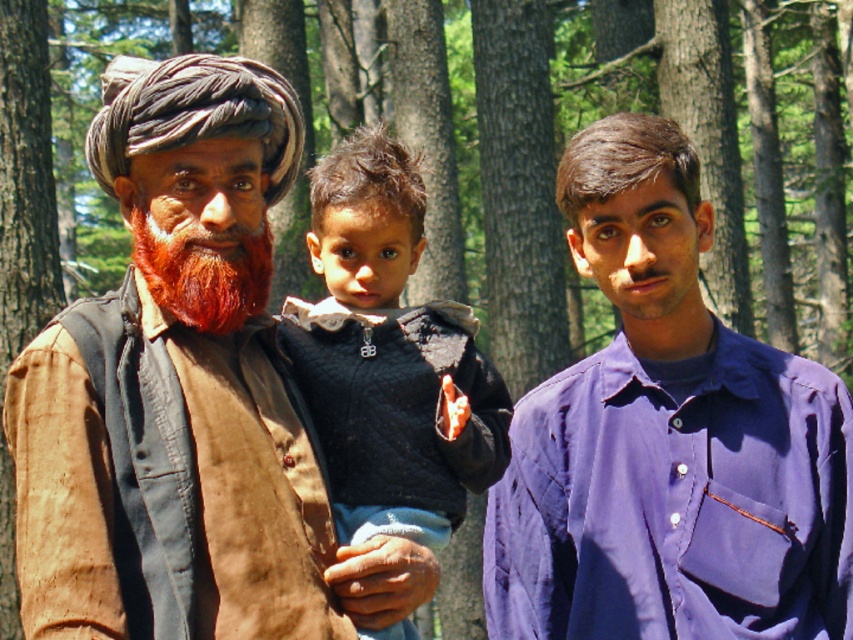
You are a photographer trying to focus on the purple cotton shirt at center in the image. What are the coordinates where you should aim your camera?

The purple cotton shirt at center is located at coordinates point (666, 440).

You are standing in the forest scene and want to place a small decoration between the two points, point (822, 556) and point (209, 285). Which point is closer to you where you should start placing the decoration?

Point (209, 285) is closer to you, so you should start placing the decoration near that point since it is nearer than point (822, 556).